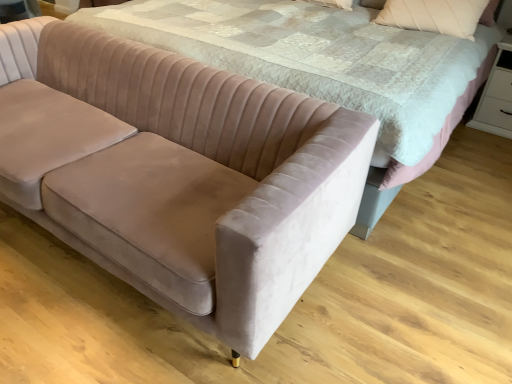
Locate an element on the screen. The image size is (512, 384). free spot in front of white glossy dresser at lower right is located at coordinates pos(486,145).